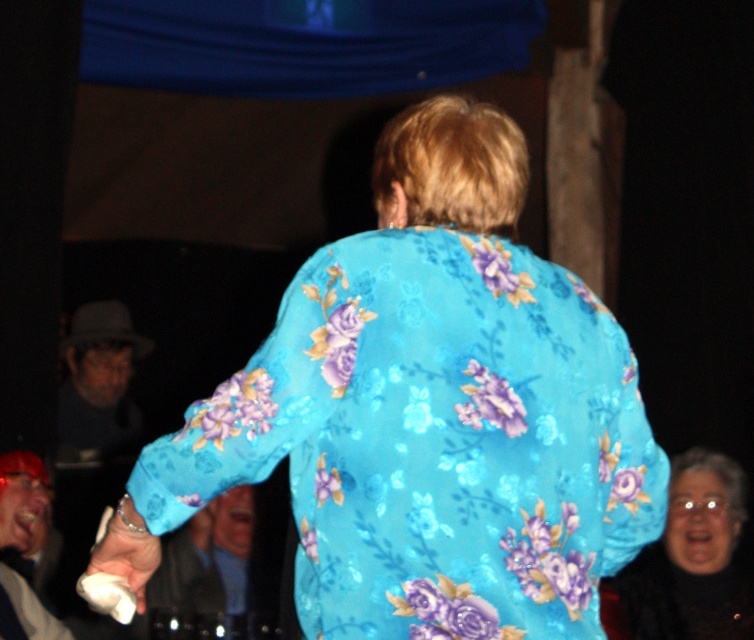
Question: From the image, what is the correct spatial relationship of floral-patterned fabric at center in relation to matte white phone at lower left?

Choices:
 (A) above
 (B) below

Answer: (A)

Question: In this image, where is floral-patterned fabric at lower right located relative to matte white phone at lower left?

Choices:
 (A) below
 (B) above

Answer: (A)

Question: Does floral-patterned fabric at center have a greater width compared to floral-patterned fabric at lower right?

Choices:
 (A) yes
 (B) no

Answer: (A)

Question: Which of the following is the closest to the observer?

Choices:
 (A) matte white phone at lower left
 (B) floral-patterned fabric at lower right
 (C) floral-patterned fabric at center

Answer: (C)

Question: Which point is closer to the camera?

Choices:
 (A) (470, 413)
 (B) (43, 609)

Answer: (A)

Question: Which point is farther from the camera taking this photo?

Choices:
 (A) (516, 492)
 (B) (682, 592)
 (C) (44, 525)

Answer: (C)